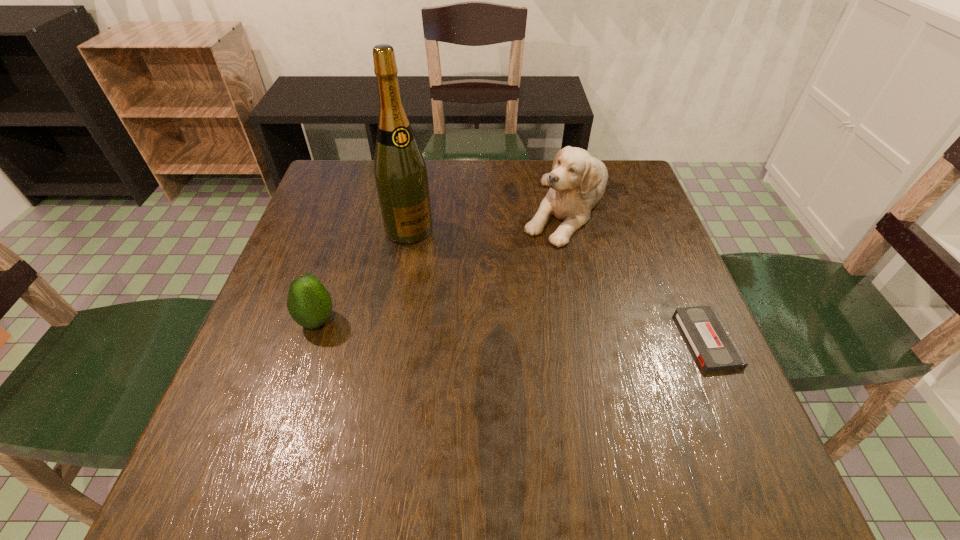
This screenshot has height=540, width=960. I want to click on object located at the far right corner, so click(577, 182).

I want to click on vacant space at the far edge of the desktop, so click(x=539, y=202).

The width and height of the screenshot is (960, 540). In the image, there is a desktop. In order to click on blank space at the near edge in this screenshot , I will do `click(503, 431)`.

Locate an element on the screen. free region at the right edge of the desktop is located at coordinates (702, 379).

I want to click on vacant space at the far left corner of the desktop, so click(358, 191).

In the image, there is a desktop. What are the coordinates of `vacant space at the far right corner` in the screenshot? It's located at (631, 171).

I want to click on vacant area at the near right corner of the desktop, so click(711, 392).

Find the location of a particular element. The width and height of the screenshot is (960, 540). vacant area between the tallest object and the avocado is located at coordinates (363, 275).

Identify the location of free space between the wine bottle and the avocado. (363, 275).

The width and height of the screenshot is (960, 540). Identify the location of vacant region between the second object from left to right and the shortest object. coord(558,285).